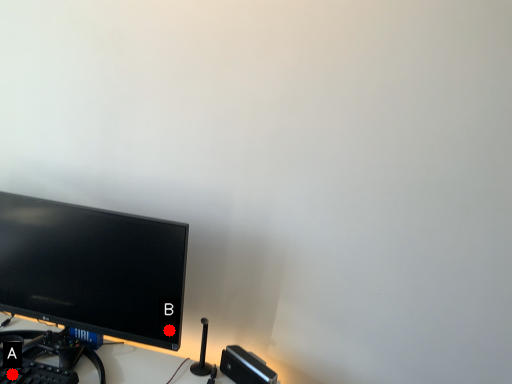
Question: Two points are circled on the image, labeled by A and B beside each circle. Among these points, which one is nearest to the camera?

Choices:
 (A) A is closer
 (B) B is closer

Answer: (A)